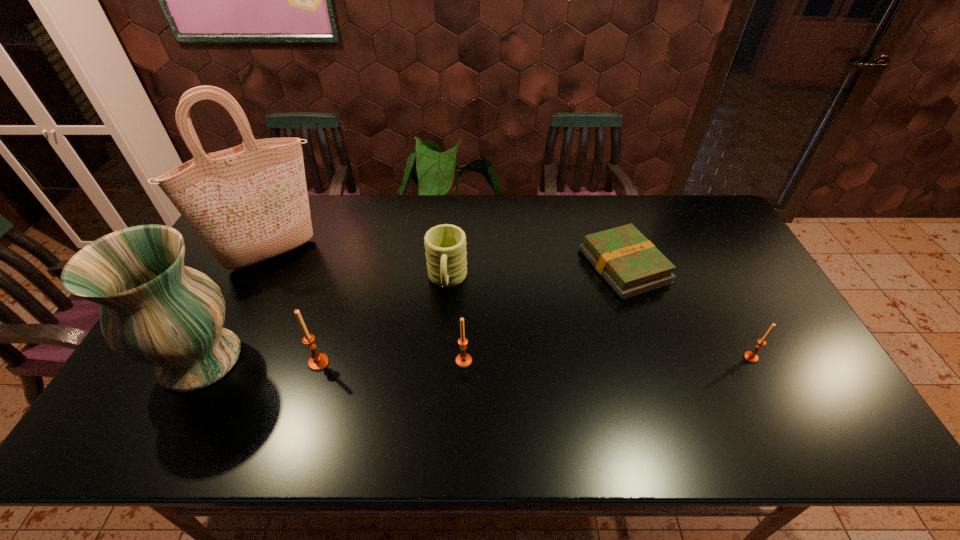
Identify the location of vacant space located on the left of the fifth object from right to left. (185, 363).

The width and height of the screenshot is (960, 540). What are the coordinates of `free location located on the back of the second tallest candle_holder` in the screenshot? It's located at (467, 279).

What are the coordinates of `free space located 0.190m on the left of the shortest candle_holder` in the screenshot? It's located at (671, 357).

The height and width of the screenshot is (540, 960). I want to click on vacant space positioned 0.250m on the right of the tallest object, so click(402, 254).

This screenshot has height=540, width=960. I want to click on free point located 0.240m on the left of the shortest object, so click(506, 266).

You are a GUI agent. You are given a task and a screenshot of the screen. Output one action in this format:
    pyautogui.click(x=<x>, y=<y>)
    Task: Click on the vacant space located 0.080m on the side of the mug with the handle
    This screenshot has height=540, width=960.
    Given the screenshot: What is the action you would take?
    pyautogui.click(x=444, y=323)

At what (x,y) coordinates should I click in order to perform the action: click on blank area located 0.250m on the right of the sixth shortest object. Please return your answer as a coordinate pair (x, y). Looking at the image, I should click on click(x=343, y=360).

The height and width of the screenshot is (540, 960). I want to click on object situated at the far edge, so tap(249, 203).

Where is `object that is at the near edge`? object that is at the near edge is located at coordinates (155, 311).

I want to click on shopping bag located at the left edge, so click(x=249, y=203).